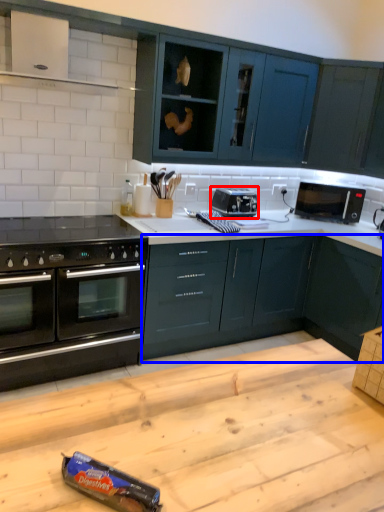
Question: Which of the following is the closest to the observer, appliance (highlighted by a red box) or cabinetry (highlighted by a blue box)?

Choices:
 (A) appliance
 (B) cabinetry

Answer: (B)